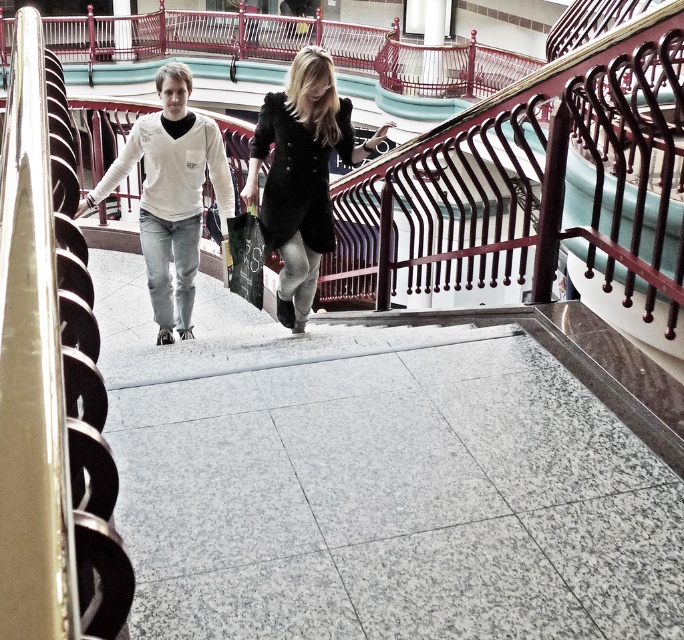
You are standing at the bottom of the staircase in the mall and see the black wool coat at center and the white matte sweater at left. Which person is closer to you?

The black wool coat at center is closer to you because it is in front of the white matte sweater at left.

You are a delivery robot in a mall. You need to deliver a package to the person wearing the black wool coat at center. There is an obstacle, the matte black handbag at upper center, blocking your path. Can you navigate around it if your turning radius is 36 inches?

The distance between the black wool coat at center and the matte black handbag at upper center is 35.88 inches. Since the turning radius of the robot is 36 inches, which is slightly larger than the distance between them, the robot cannot navigate around the matte black handbag at upper center without coming into contact with it.